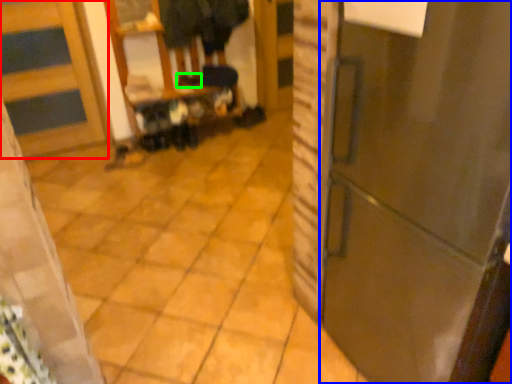
Question: Which object is positioned farthest from door (highlighted by a red box)? Select from door (highlighted by a blue box) and shoe (highlighted by a green box).

Choices:
 (A) door
 (B) shoe

Answer: (A)